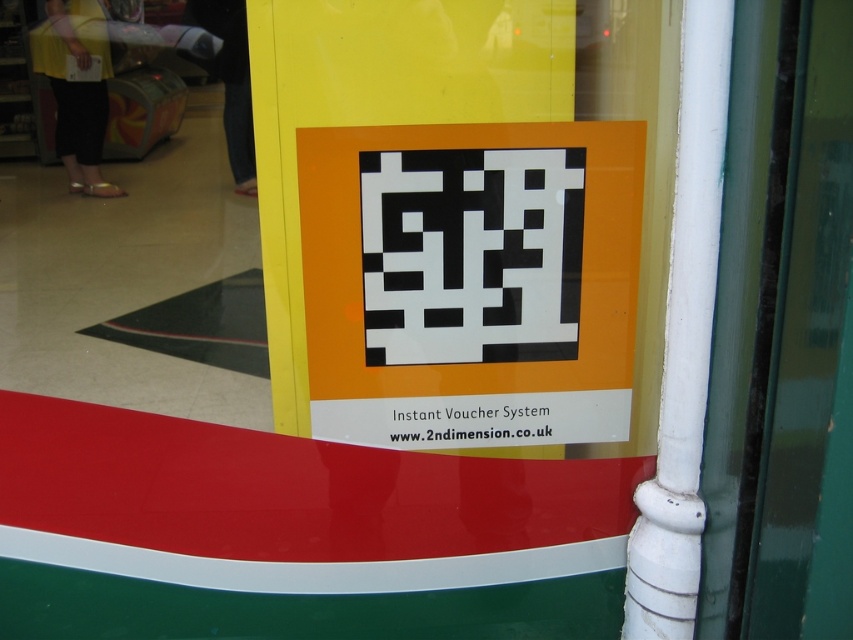
Question: Is black paper qr code at center closer to camera compared to black pixelated qr code at center?

Choices:
 (A) yes
 (B) no

Answer: (A)

Question: Can you confirm if black paper qr code at center is thinner than black pixelated qr code at center?

Choices:
 (A) yes
 (B) no

Answer: (B)

Question: Is black paper qr code at center below black pixelated qr code at center?

Choices:
 (A) yes
 (B) no

Answer: (A)

Question: Which object appears closest to the camera in this image?

Choices:
 (A) black pixelated qr code at center
 (B) black paper qr code at center

Answer: (B)